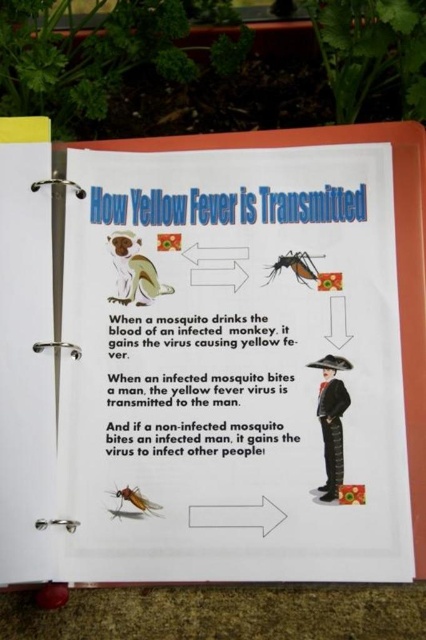
Where is the point labeled as point (213, 356) located on the page?

The point labeled as point (213, 356) is located on the white paper at center.

You are a student looking at the image of the monkey in the educational material. You notice the white paper at center and the translucent white mosquito at center. Which object is closer to you?

The translucent white mosquito at center is closer to you because it is positioned over the white paper at center.